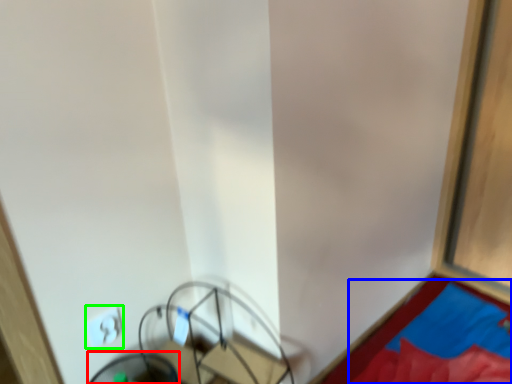
Question: Estimate the real-world distances between objects in this image. Which object is closer to swivel chair (highlighted by a red box), sheet (highlighted by a blue box) or light switch (highlighted by a green box)?

Choices:
 (A) sheet
 (B) light switch

Answer: (B)